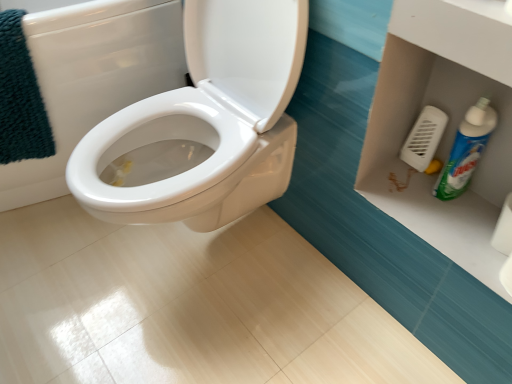
Identify the location of vacant area that is in front of white plastic vent at right. Image resolution: width=512 pixels, height=384 pixels. (433, 204).